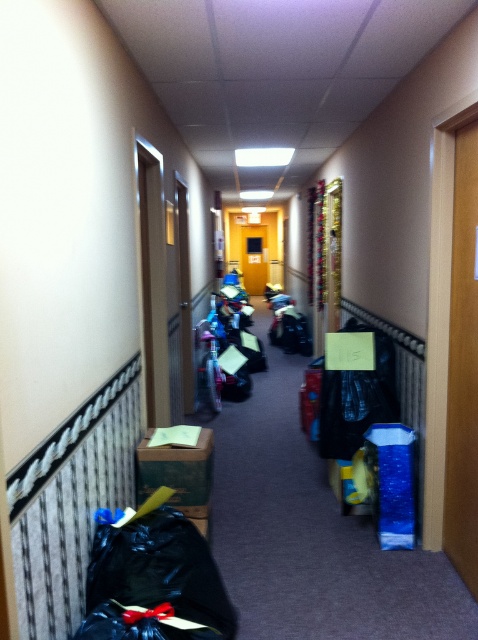
You are moving a green cardboard box at lower center and a black plastic bag at lower left into a storage room. To ensure proper stacking, you need to place the item that is closer to you first. Which item should you move first?

The black plastic bag at lower left is in front of the green cardboard box at lower center, so you should move the black plastic bag at lower left first since it is closer to you.

Looking at this image, you are moving boxes and bags down a hallway and need to place them in order from tallest to shortest. Which should come first, the black plastic bag at lower left or the green cardboard box at lower center?

The black plastic bag at lower left is much taller than the green cardboard box at lower center, so it should come first in the order from tallest to shortest.

You are moving into a new apartment and need to carry the black plastic bag at lower left and the green cardboard box at lower center down a hallway. If you can only carry one item at a time, which item would require more space due to its size?

The black plastic bag at lower left requires more space because it is larger in size than the green cardboard box at lower center according to the description.